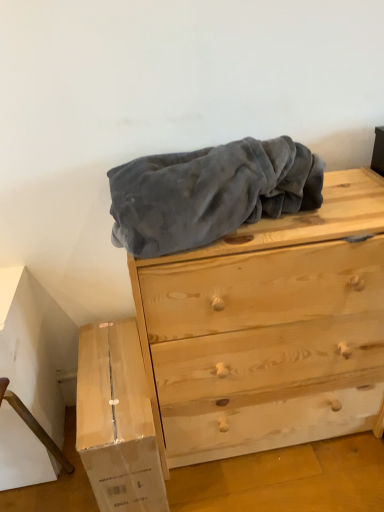
Question: From the image's perspective, is light brown wood chest of drawers at center located above white cardboard box at lower left?

Choices:
 (A) yes
 (B) no

Answer: (A)

Question: Is light brown wood chest of drawers at center wider than white cardboard box at lower left?

Choices:
 (A) no
 (B) yes

Answer: (A)

Question: Is light brown wood chest of drawers at center in front of white cardboard box at lower left?

Choices:
 (A) yes
 (B) no

Answer: (A)

Question: Can you confirm if light brown wood chest of drawers at center is shorter than white cardboard box at lower left?

Choices:
 (A) yes
 (B) no

Answer: (B)

Question: Does light brown wood chest of drawers at center appear on the left side of white cardboard box at lower left?

Choices:
 (A) yes
 (B) no

Answer: (B)

Question: Considering the relative sizes of light brown wood chest of drawers at center and white cardboard box at lower left in the image provided, is light brown wood chest of drawers at center thinner than white cardboard box at lower left?

Choices:
 (A) yes
 (B) no

Answer: (A)

Question: From a real-world perspective, is white cardboard box at lower left on light brown wood chest of drawers at center?

Choices:
 (A) no
 (B) yes

Answer: (A)

Question: Is white cardboard box at lower left in contact with light brown wood chest of drawers at center?

Choices:
 (A) yes
 (B) no

Answer: (B)

Question: Does white cardboard box at lower left turn towards light brown wood chest of drawers at center?

Choices:
 (A) no
 (B) yes

Answer: (A)

Question: Is white cardboard box at lower left oriented away from light brown wood chest of drawers at center?

Choices:
 (A) yes
 (B) no

Answer: (B)

Question: Is light brown wood chest of drawers at center located within white cardboard box at lower left?

Choices:
 (A) no
 (B) yes

Answer: (A)

Question: Does white cardboard box at lower left come in front of light brown wood chest of drawers at center?

Choices:
 (A) no
 (B) yes

Answer: (A)

Question: From the image's perspective, is white cardboard box at lower left located above or below light brown wood chest of drawers at center?

Choices:
 (A) below
 (B) above

Answer: (A)